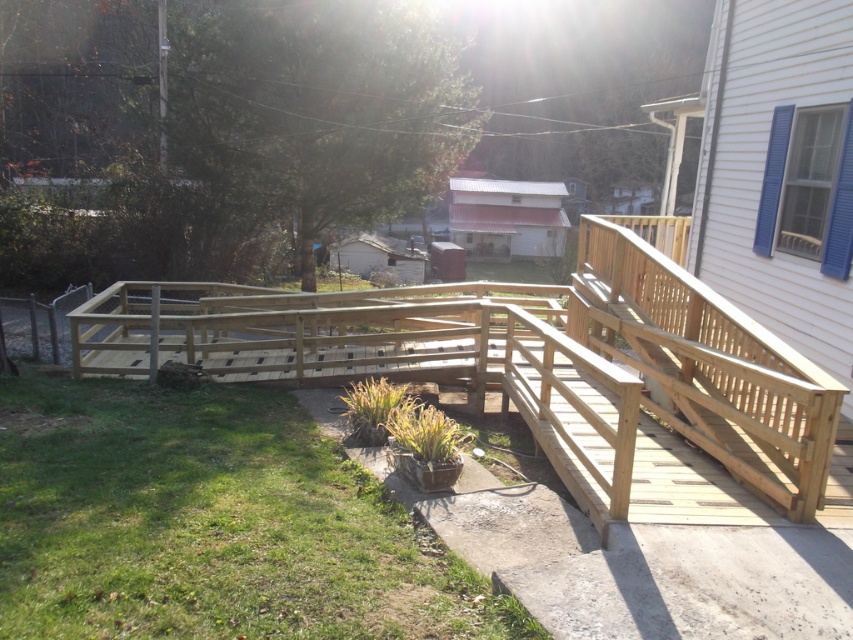
Is natural wood porch at center shorter than natural wood handrail at upper right?

No.

Does natural wood porch at center have a greater height compared to natural wood handrail at upper right?

Indeed, natural wood porch at center has a greater height compared to natural wood handrail at upper right.

Which is behind, point (633, 378) or point (749, 429)?

The point (633, 378) is more distant.

The image size is (853, 640). Identify the location of natural wood porch at center. 537,371.